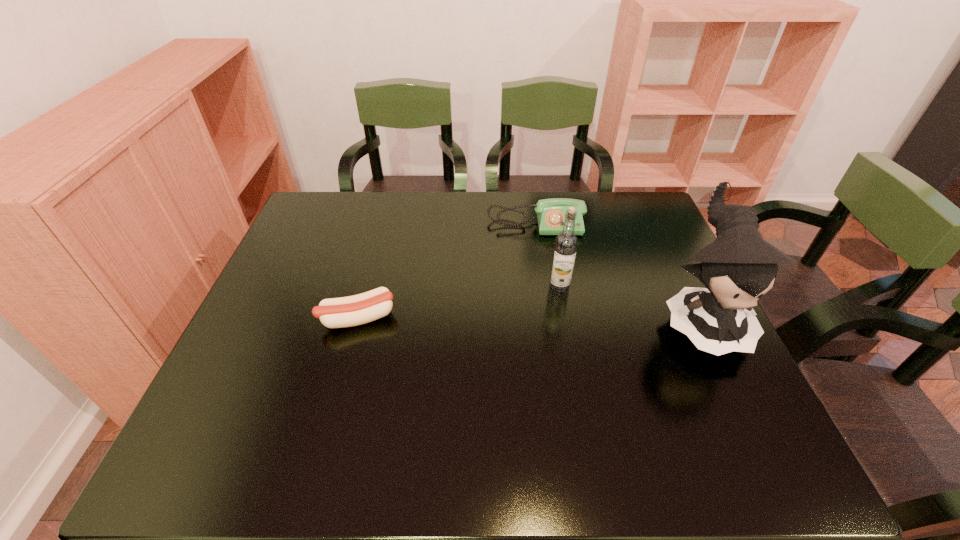
Where is `free space on the desktop that is between the shortest object and the tallest object and is positioned on the dial of the telephone`? The width and height of the screenshot is (960, 540). free space on the desktop that is between the shortest object and the tallest object and is positioned on the dial of the telephone is located at coordinates (546, 319).

Where is `free space on the desktop that is between the leftmost object and the doll and is positioned on the label of the second tallest object`? The width and height of the screenshot is (960, 540). free space on the desktop that is between the leftmost object and the doll and is positioned on the label of the second tallest object is located at coordinates (492, 319).